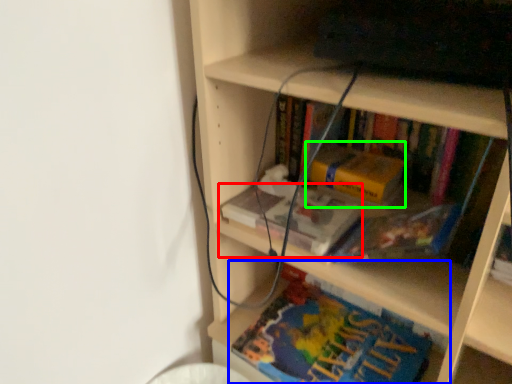
Question: Which object is the farthest from book (highlighted by a red box)? Choose among these: book (highlighted by a blue box) or paperback book (highlighted by a green box).

Choices:
 (A) book
 (B) paperback book

Answer: (A)